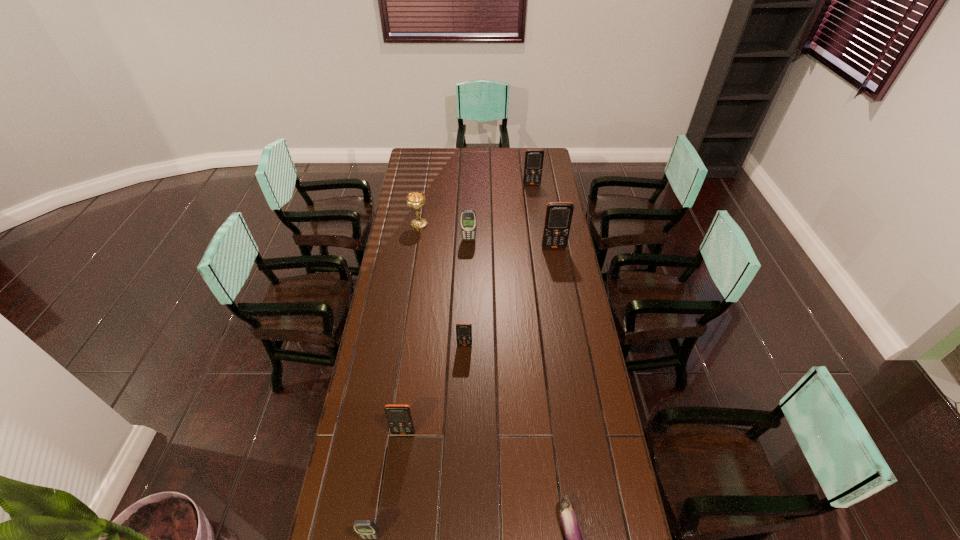
Locate an element on the screen. This screenshot has width=960, height=540. free spot at the far edge of the desktop is located at coordinates (460, 168).

Locate an element on the screen. free space at the left edge is located at coordinates (410, 271).

Where is `vacant space at the right edge`? The image size is (960, 540). vacant space at the right edge is located at coordinates (585, 528).

Image resolution: width=960 pixels, height=540 pixels. I want to click on vacant area at the far left corner, so click(x=420, y=151).

This screenshot has height=540, width=960. What are the coordinates of `free area in between the farthest orange cellular telephone and the second farthest orange cellular telephone` in the screenshot? It's located at (542, 216).

The image size is (960, 540). In order to click on empty location between the third nearest object and the nearer gray cellular telephone in this screenshot , I will do `click(387, 484)`.

Identify the location of free space that is in between the nearest orange cellular telephone and the left gray cellular telephone. (387, 484).

Locate an element on the screen. The height and width of the screenshot is (540, 960). free space between the smallest orange cellular telephone and the smaller gray cellular telephone is located at coordinates (418, 441).

The image size is (960, 540). I want to click on vacant area that lies between the fourth nearest cellular telephone and the right gray cellular telephone, so click(x=512, y=244).

Find the location of `free space between the bigger gray cellular telephone and the fifth shortest cellular telephone`. free space between the bigger gray cellular telephone and the fifth shortest cellular telephone is located at coordinates (500, 212).